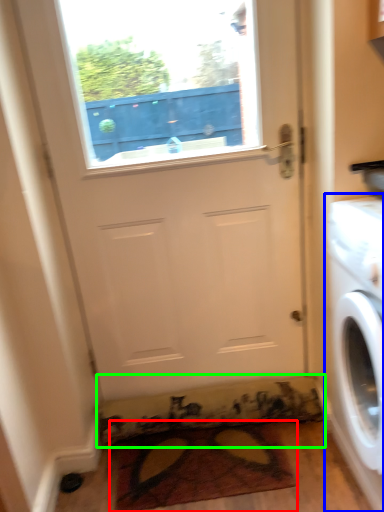
Question: Which object is positioned closest to doormat (highlighted by a red box)? Select from washing machine (highlighted by a blue box) and doormat (highlighted by a green box).

Choices:
 (A) washing machine
 (B) doormat

Answer: (B)